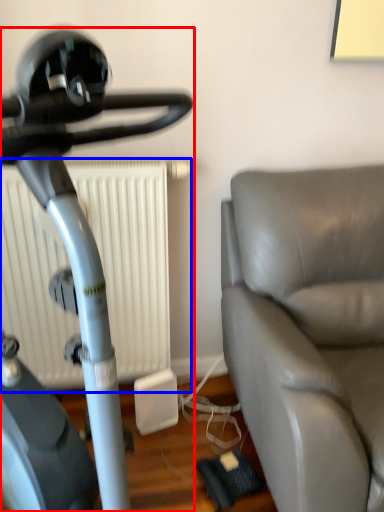
Question: Which point is closer to the camera, stationary bicycle (highlighted by a red box) or radiator (highlighted by a blue box)?

Choices:
 (A) stationary bicycle
 (B) radiator

Answer: (A)